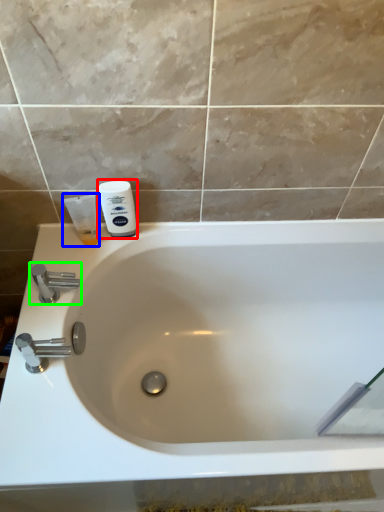
Question: Based on their relative distances, which object is farther from shaving cream (highlighted by a red box)? Choose from shaving cream (highlighted by a blue box) and tap (highlighted by a green box).

Choices:
 (A) shaving cream
 (B) tap

Answer: (B)